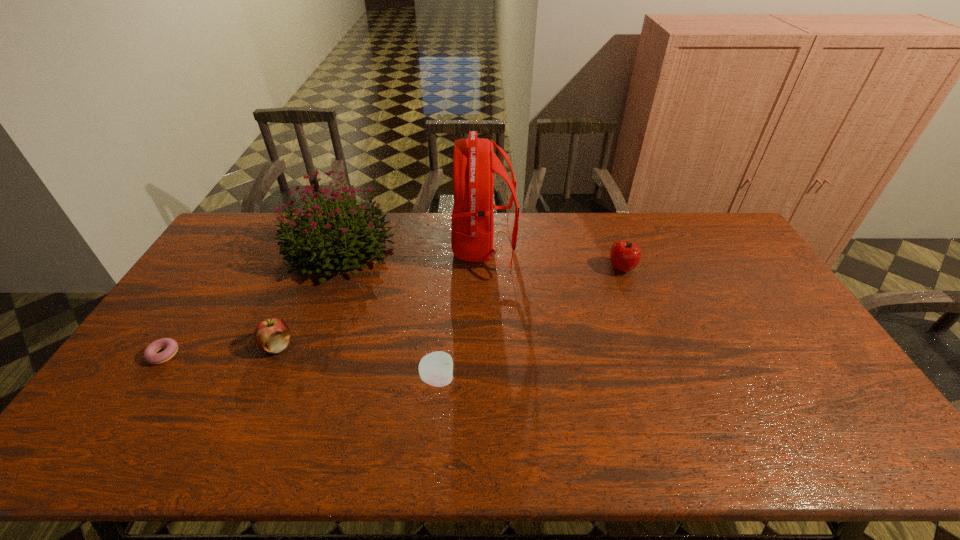
You are a GUI agent. You are given a task and a screenshot of the screen. Output one action in this format:
    pyautogui.click(x=<x>, y=<y>)
    Task: Click on the blank space located 0.070m on the main compartment of the tallest object
    Image resolution: width=960 pixels, height=540 pixels.
    Given the screenshot: What is the action you would take?
    pyautogui.click(x=433, y=247)

Where is `free point located on the front of the bouquet`? Image resolution: width=960 pixels, height=540 pixels. free point located on the front of the bouquet is located at coordinates (297, 366).

The image size is (960, 540). Find the location of `free spot located on the back of the rightmost object`. free spot located on the back of the rightmost object is located at coordinates (606, 224).

The width and height of the screenshot is (960, 540). Find the location of `vacant area situated 0.380m on the right of the leftmost apple`. vacant area situated 0.380m on the right of the leftmost apple is located at coordinates (428, 346).

You are a GUI agent. You are given a task and a screenshot of the screen. Output one action in this format:
    pyautogui.click(x=<x>, y=<y>)
    Task: Click on the blank space located on the left of the nearest apple
    The height and width of the screenshot is (540, 960).
    Given the screenshot: What is the action you would take?
    pyautogui.click(x=368, y=379)

Find the location of `free point located 0.320m on the back of the doughnut`. free point located 0.320m on the back of the doughnut is located at coordinates (221, 269).

The image size is (960, 540). In order to click on backpack that is at the far edge in this screenshot , I will do `click(474, 162)`.

Where is `bouquet positioned at the far edge`? The width and height of the screenshot is (960, 540). bouquet positioned at the far edge is located at coordinates (309, 244).

Find the location of `object present at the left edge`. object present at the left edge is located at coordinates (150, 355).

In the image, there is a desktop. In order to click on vacant space at the far edge in this screenshot , I will do `click(421, 227)`.